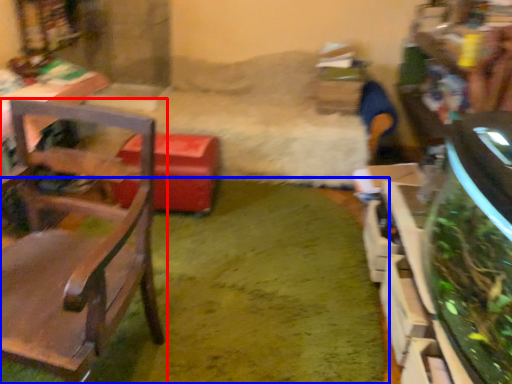
Question: Among these objects, which one is farthest to the camera, chair (highlighted by a red box) or grass (highlighted by a blue box)?

Choices:
 (A) chair
 (B) grass

Answer: (B)